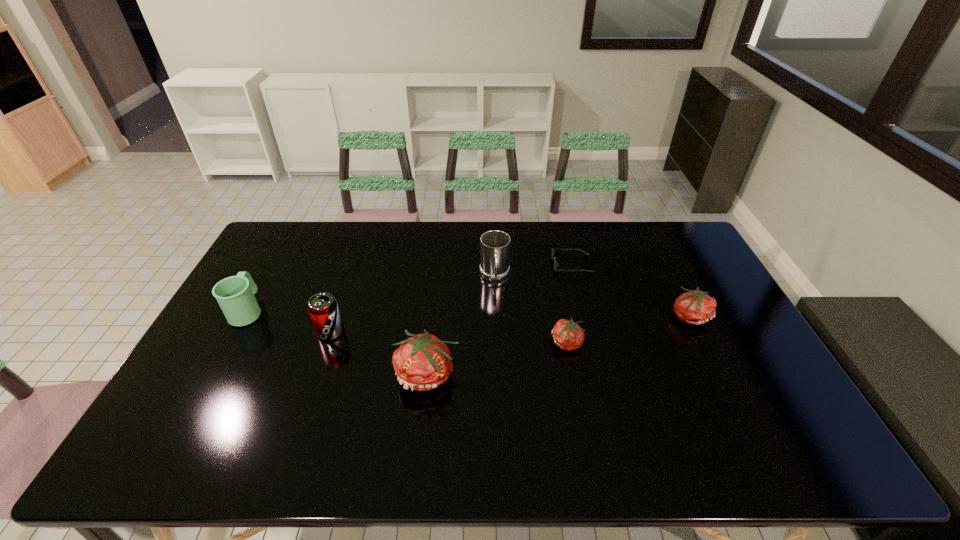
Where is `vacant space situated 0.160m on the side of the nearer mug with the handle`? The image size is (960, 540). vacant space situated 0.160m on the side of the nearer mug with the handle is located at coordinates (275, 263).

Identify the location of free space located on the side of the nearer mug with the handle. This screenshot has width=960, height=540. pyautogui.click(x=276, y=261).

You are a GUI agent. You are given a task and a screenshot of the screen. Output one action in this format:
    pyautogui.click(x=<x>, y=<y>)
    Task: Click on the vacant area situated on the side of the nearer mug with the handle
    The width and height of the screenshot is (960, 540).
    Given the screenshot: What is the action you would take?
    pyautogui.click(x=284, y=245)

Find the location of a particular element. Image resolution: width=960 pixels, height=540 pixels. object at the far edge is located at coordinates (556, 264).

This screenshot has height=540, width=960. Identify the location of object that is at the near edge. (422, 362).

Locate an element on the screen. The height and width of the screenshot is (540, 960). object that is at the left edge is located at coordinates (235, 295).

You are a GUI agent. You are given a task and a screenshot of the screen. Output one action in this format:
    pyautogui.click(x=<x>, y=<y>)
    Task: Click on the object at the right edge
    The image size is (960, 540).
    Given the screenshot: What is the action you would take?
    pyautogui.click(x=695, y=307)

Identify the location of vacant space at the far edge. The image size is (960, 540). (440, 247).

In order to click on free point at the near edge in this screenshot , I will do `click(583, 404)`.

You are a GUI agent. You are given a task and a screenshot of the screen. Output one action in this format:
    pyautogui.click(x=<x>, y=<y>)
    Task: Click on the free space at the right edge of the desktop
    The height and width of the screenshot is (540, 960).
    Given the screenshot: What is the action you would take?
    click(676, 275)